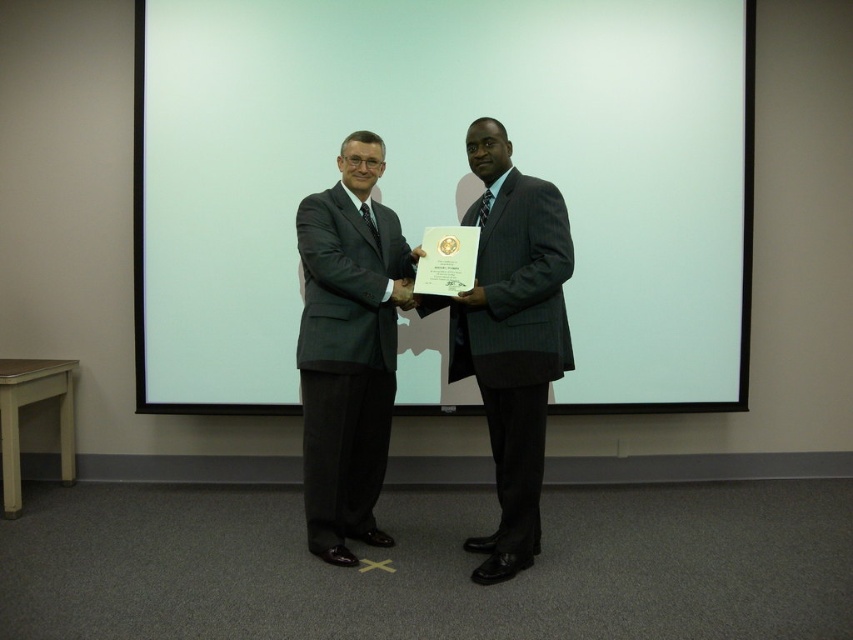
Does matte black suit at center have a lesser height compared to gray pinstripe suit at center?

Indeed, matte black suit at center has a lesser height compared to gray pinstripe suit at center.

Is matte black suit at center smaller than gray pinstripe suit at center?

Correct, matte black suit at center occupies less space than gray pinstripe suit at center.

Describe the element at coordinates (347, 348) in the screenshot. This screenshot has height=640, width=853. I see `matte black suit at center` at that location.

Image resolution: width=853 pixels, height=640 pixels. I want to click on matte black suit at center, so click(x=347, y=348).

Does point (270, 312) come behind point (485, 125)?

That is True.

Does white matte screen at center appear on the right side of gray pinstripe suit at center?

In fact, white matte screen at center is to the left of gray pinstripe suit at center.

Between point (421, 83) and point (532, 428), which one is positioned behind?

Positioned behind is point (421, 83).

Find the location of a particular element. white matte screen at center is located at coordinates (445, 176).

Which is more to the right, white matte screen at center or matte black suit at center?

white matte screen at center is more to the right.

Is white matte screen at center above matte black suit at center?

Correct, white matte screen at center is located above matte black suit at center.

Which is behind, point (585, 192) or point (347, 476)?

Positioned behind is point (585, 192).

Identify the location of white matte screen at center. (445, 176).